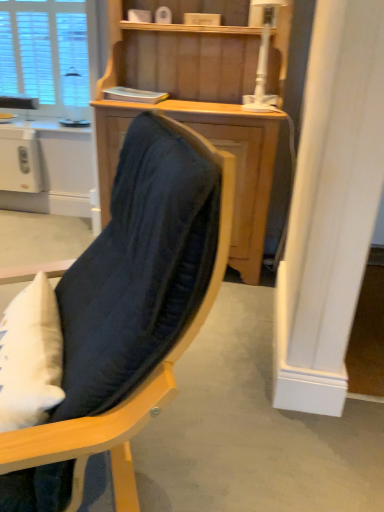
Question: From a real-world perspective, is velvet dark blue chair at center on wooden cabinet at center?

Choices:
 (A) no
 (B) yes

Answer: (A)

Question: Could wooden cabinet at center be considered to be inside velvet dark blue chair at center?

Choices:
 (A) yes
 (B) no

Answer: (B)

Question: Is velvet dark blue chair at center bigger than wooden cabinet at center?

Choices:
 (A) no
 (B) yes

Answer: (A)

Question: Does velvet dark blue chair at center have a smaller size compared to wooden cabinet at center?

Choices:
 (A) no
 (B) yes

Answer: (B)

Question: Is velvet dark blue chair at center taller than wooden cabinet at center?

Choices:
 (A) yes
 (B) no

Answer: (B)

Question: Is wooden cabinet at center taller or shorter than white plastic lamp at upper center?

Choices:
 (A) tall
 (B) short

Answer: (A)

Question: Based on their sizes in the image, would you say wooden cabinet at center is bigger or smaller than white plastic lamp at upper center?

Choices:
 (A) small
 (B) big

Answer: (B)

Question: From the image's perspective, is wooden cabinet at center located above or below white plastic lamp at upper center?

Choices:
 (A) above
 (B) below

Answer: (B)

Question: From a real-world perspective, relative to white plastic lamp at upper center, is wooden cabinet at center vertically above or below?

Choices:
 (A) above
 (B) below

Answer: (B)

Question: Looking at their shapes, would you say white textured window at upper left is wider or thinner than wooden cabinet at center?

Choices:
 (A) wide
 (B) thin

Answer: (B)

Question: In the image, is white textured window at upper left positioned in front of or behind wooden cabinet at center?

Choices:
 (A) front
 (B) behind

Answer: (B)

Question: Is point (49, 91) positioned closer to the camera than point (168, 96)?

Choices:
 (A) closer
 (B) farther

Answer: (B)

Question: Would you say white textured window at upper left is to the left or to the right of wooden cabinet at center in the picture?

Choices:
 (A) left
 (B) right

Answer: (A)

Question: From a real-world perspective, is white plastic lamp at upper center above or below white plastic toaster at left?

Choices:
 (A) above
 (B) below

Answer: (A)

Question: Is point (256, 99) closer or farther from the camera than point (18, 139)?

Choices:
 (A) farther
 (B) closer

Answer: (B)